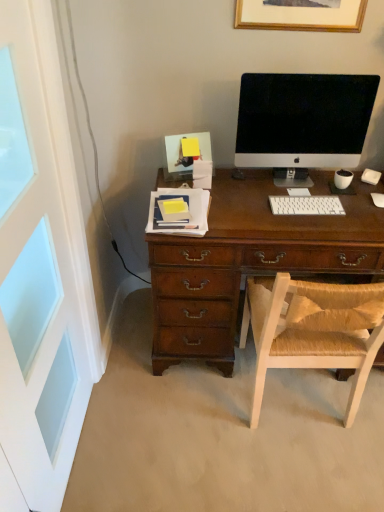
Question: Can you confirm if white plastic keyboard at center is taller than wooden picture frame at upper center?

Choices:
 (A) no
 (B) yes

Answer: (A)

Question: Can you confirm if white plastic keyboard at center is bigger than wooden picture frame at upper center?

Choices:
 (A) yes
 (B) no

Answer: (B)

Question: Is the position of white plastic keyboard at center more distant than that of wooden picture frame at upper center?

Choices:
 (A) yes
 (B) no

Answer: (A)

Question: Is white plastic keyboard at center next to wooden picture frame at upper center and touching it?

Choices:
 (A) no
 (B) yes

Answer: (A)

Question: From a real-world perspective, is white plastic keyboard at center physically above wooden picture frame at upper center?

Choices:
 (A) yes
 (B) no

Answer: (B)

Question: Is white plastic keyboard at center oriented away from wooden picture frame at upper center?

Choices:
 (A) no
 (B) yes

Answer: (A)

Question: From the image's perspective, is satin black monitor at center over white painted wood screen door at left?

Choices:
 (A) no
 (B) yes

Answer: (B)

Question: Considering the relative sizes of satin black monitor at center and white painted wood screen door at left in the image provided, is satin black monitor at center thinner than white painted wood screen door at left?

Choices:
 (A) yes
 (B) no

Answer: (B)

Question: Is satin black monitor at center not close to white painted wood screen door at left?

Choices:
 (A) no
 (B) yes

Answer: (A)

Question: Considering the relative positions of satin black monitor at center and white painted wood screen door at left in the image provided, is satin black monitor at center to the left of white painted wood screen door at left from the viewer's perspective?

Choices:
 (A) yes
 (B) no

Answer: (B)

Question: Does satin black monitor at center turn towards white painted wood screen door at left?

Choices:
 (A) yes
 (B) no

Answer: (B)

Question: Is satin black monitor at center to the right of white painted wood screen door at left from the viewer's perspective?

Choices:
 (A) no
 (B) yes

Answer: (B)

Question: Considering the relative sizes of light brown woven chair at center and satin black monitor at center in the image provided, is light brown woven chair at center wider than satin black monitor at center?

Choices:
 (A) no
 (B) yes

Answer: (B)